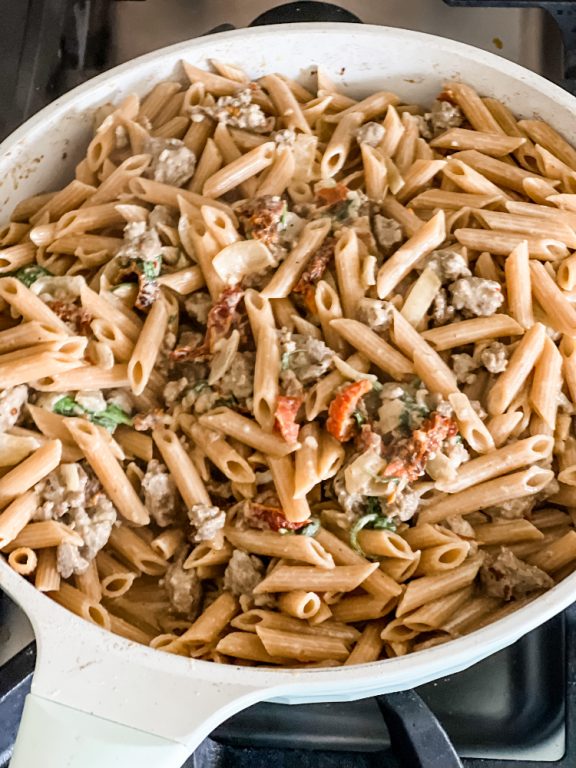
At what (x,y) coordinates should I click in order to perform the action: click on sauce spray on pot. Please return your answer as a coordinate pair (x, y). Looking at the image, I should click on (22, 159), (340, 58).